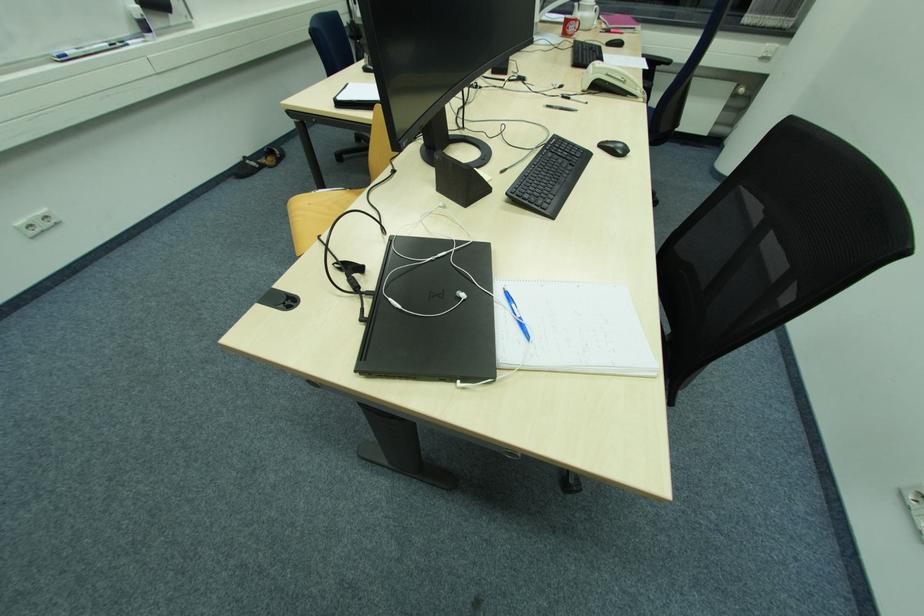
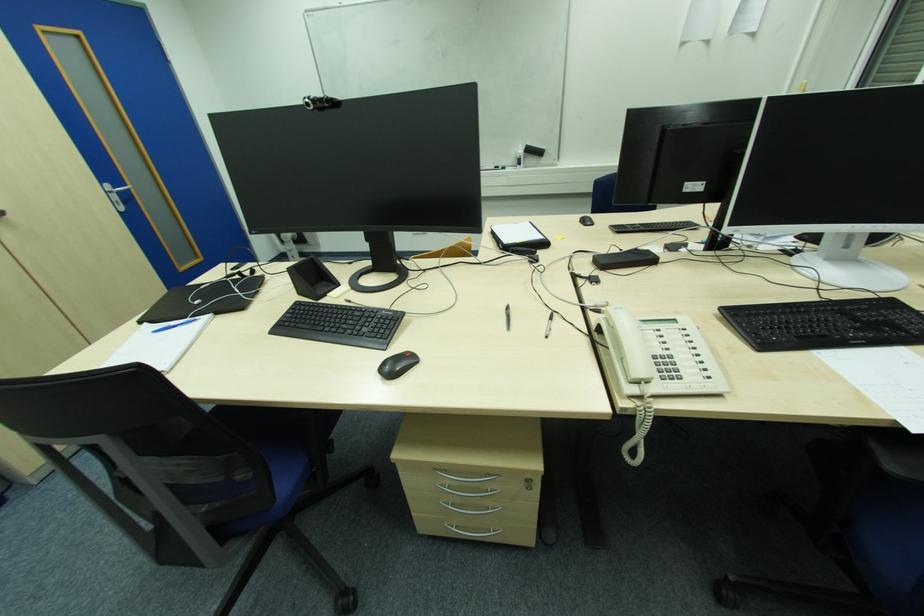
Locate, in the second image, the point that corresponds to [551,108] in the first image.

(509, 309)